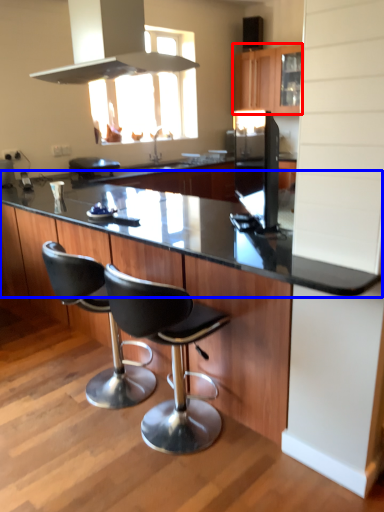
Question: Which object is further to the camera taking this photo, cabinetry (highlighted by a red box) or countertop (highlighted by a blue box)?

Choices:
 (A) cabinetry
 (B) countertop

Answer: (A)